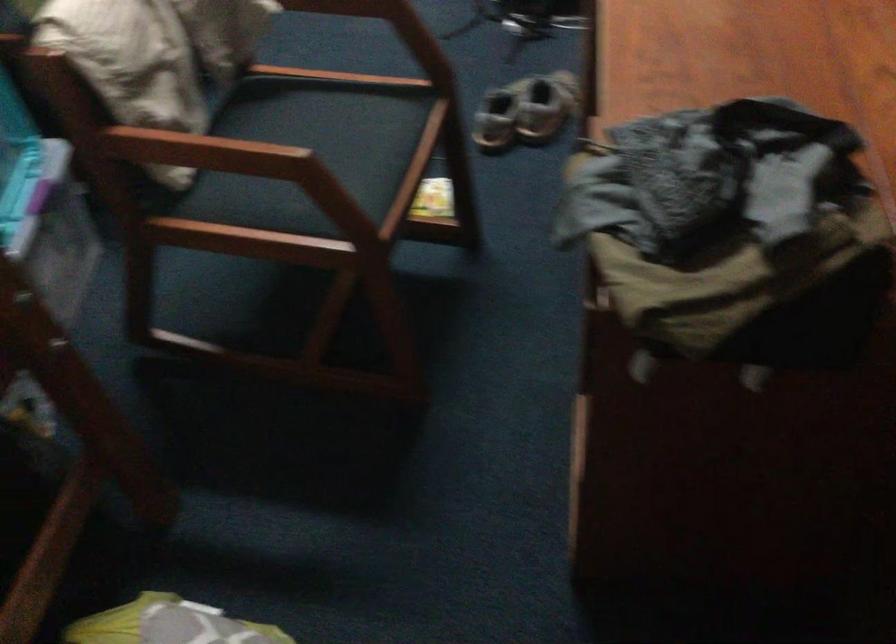
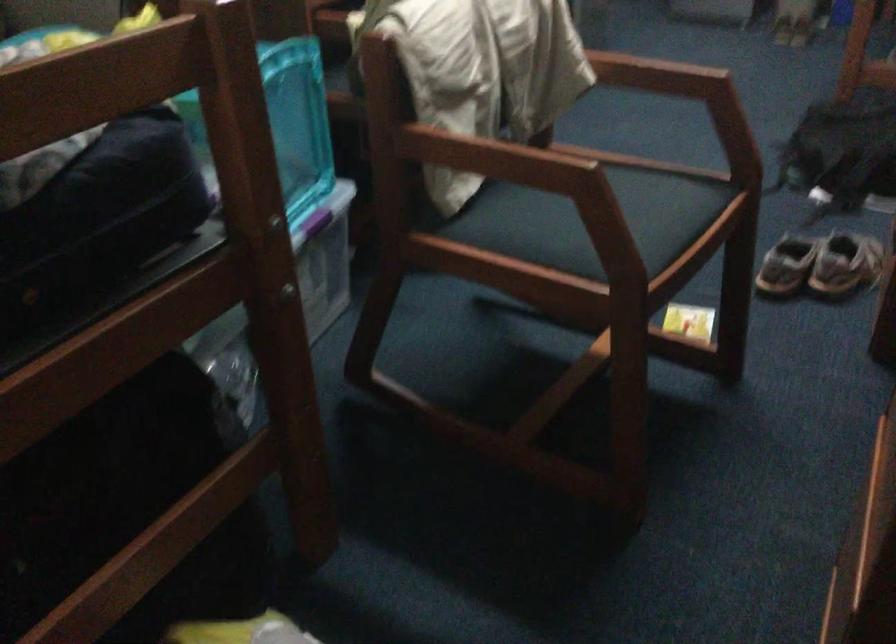
Question: Which direction would the cameraman need to move to produce the second image? Reply with the corresponding letter.

Choices:
 (A) Left
 (B) Right
 (C) Forward
 (D) Backward

Answer: (C)